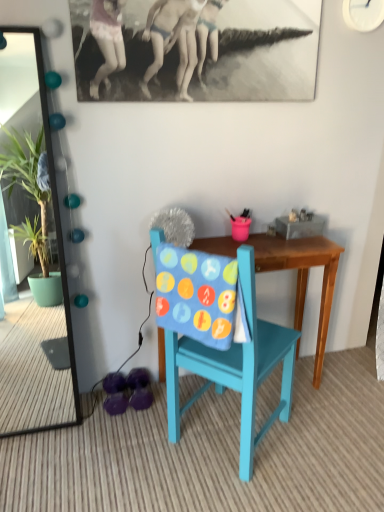
You are a GUI agent. You are given a task and a screenshot of the screen. Output one action in this format:
    pyautogui.click(x=<x>, y=<y>)
    Task: Click on the vacant area that lies between wooden table at center and teal painted wood chair at center
    
    Given the screenshot: What is the action you would take?
    pyautogui.click(x=281, y=443)